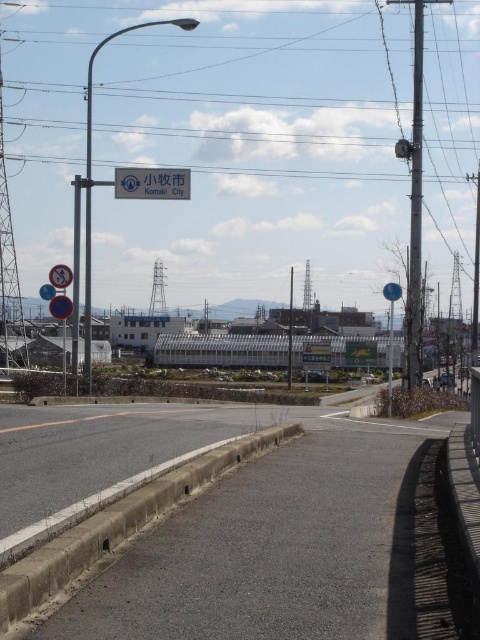
Question: Is metallic pole at right positioned before metallic pole at center?

Choices:
 (A) yes
 (B) no

Answer: (A)

Question: Does gray concrete curb at lower left have a larger size compared to metallic pole at right?

Choices:
 (A) no
 (B) yes

Answer: (A)

Question: Which of these objects is positioned farthest from the metallic pole at right?

Choices:
 (A) blue plastic sign at left
 (B) blue plastic sign at upper center

Answer: (B)

Question: Which object appears farthest from the camera in this image?

Choices:
 (A) blue plastic sign at upper center
 (B) white plastic sign at upper center
 (C) metallic pole at center
 (D) blue plastic sign at left

Answer: (C)

Question: Which point is farther from the camera taking this photo?

Choices:
 (A) (143, 186)
 (B) (290, 365)
 (C) (64, 310)

Answer: (B)

Question: Does gray concrete curb at lower left appear on the right side of blue plastic sign at upper center?

Choices:
 (A) yes
 (B) no

Answer: (B)